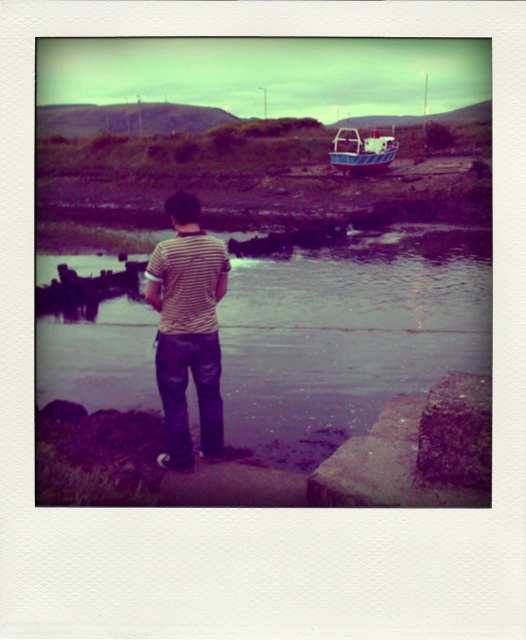
Who is more distant from viewer, [237,440] or [166,416]?

Point [237,440]

Describe the element at coordinates (348, 333) in the screenshot. The height and width of the screenshot is (640, 526). I see `purple water at center` at that location.

Who is more distant from viewer, (308, 273) or (174, 456)?

The point (308, 273) is behind.

I want to click on purple water at center, so click(348, 333).

Does purple water at center have a larger size compared to blue painted wooden boat at upper right?

Yes.

Looking at this image, does purple water at center appear on the left side of blue painted wooden boat at upper right?

Indeed, purple water at center is positioned on the left side of blue painted wooden boat at upper right.

The image size is (526, 640). What do you see at coordinates (348, 333) in the screenshot?
I see `purple water at center` at bounding box center [348, 333].

Image resolution: width=526 pixels, height=640 pixels. In order to click on purple water at center in this screenshot , I will do `click(348, 333)`.

Is striped cotton shirt at center below blue painted wooden boat at upper right?

Correct, striped cotton shirt at center is located below blue painted wooden boat at upper right.

Who is taller, striped cotton shirt at center or blue painted wooden boat at upper right?

striped cotton shirt at center is taller.

At what (x,y) coordinates should I click in order to perform the action: click on striped cotton shirt at center. Please return your answer as a coordinate pair (x, y). Image resolution: width=526 pixels, height=640 pixels. Looking at the image, I should click on (x=187, y=330).